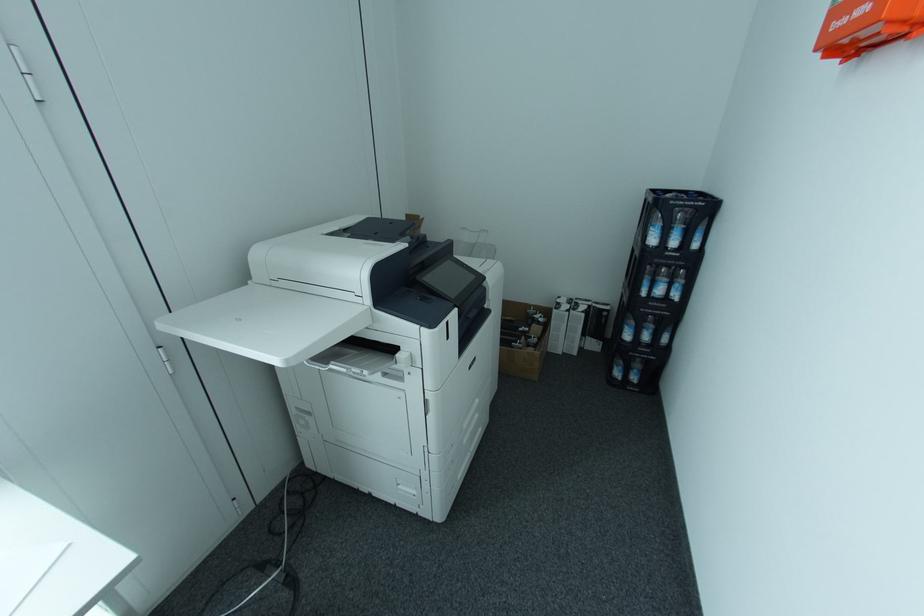
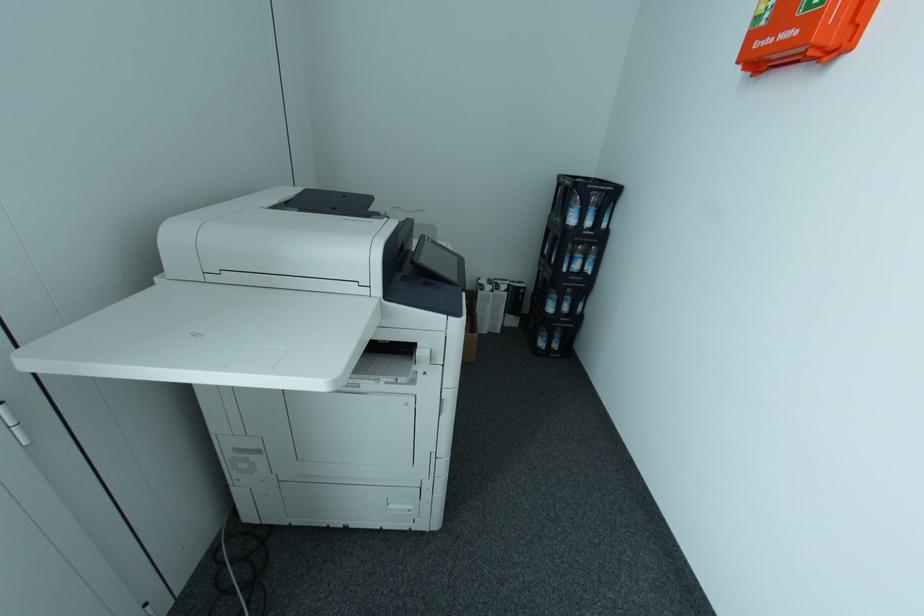
What movement of the cameraman would produce the second image?

The cameraman walked toward left, forward.